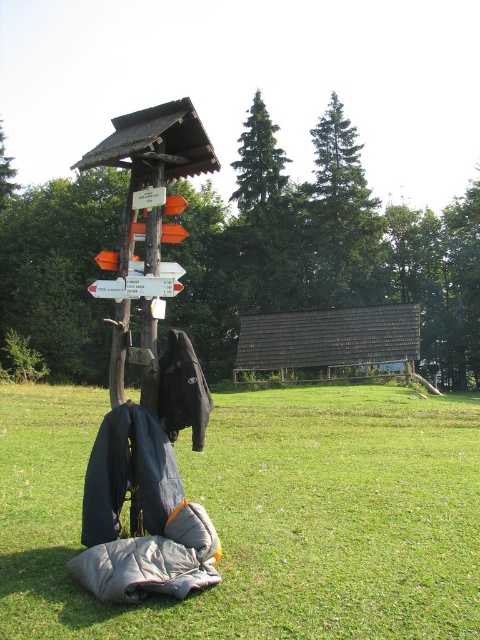
Question: Which object appears farthest from the camera in this image?

Choices:
 (A) green leafy tree at upper center
 (B) gray fabric sleeping bag at lower center
 (C) orange wood signpost at upper center
 (D) brown shingled hut at center

Answer: (D)

Question: Which of the following is the farthest from the observer?

Choices:
 (A) (423, 284)
 (B) (475, 604)
 (C) (149, 266)
 (D) (142, 294)

Answer: (A)

Question: Is green leafy tree at upper center further to camera compared to brown shingled hut at center?

Choices:
 (A) yes
 (B) no

Answer: (B)

Question: Considering the relative positions of green leafy tree at upper center and white plastic sign at center in the image provided, where is green leafy tree at upper center located with respect to white plastic sign at center?

Choices:
 (A) above
 (B) below

Answer: (A)

Question: From the image, what is the correct spatial relationship of green leafy tree at upper center in relation to white plastic sign at center?

Choices:
 (A) above
 (B) below

Answer: (A)

Question: Which point appears closest to the camera in this image?

Choices:
 (A) (152, 292)
 (B) (192, 300)
 (C) (259, 324)
 (D) (476, 412)

Answer: (A)